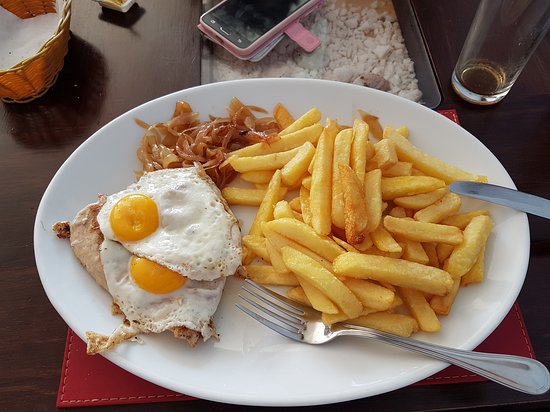
This screenshot has height=412, width=550. What are the coordinates of `fork` in the screenshot? It's located at (472, 363).